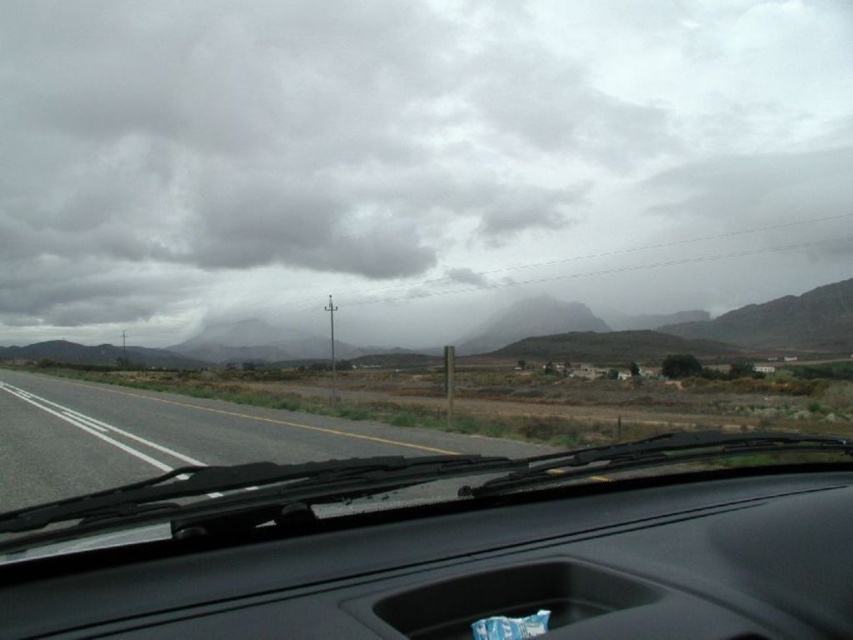
Question: Is gray cloudy sky at upper center positioned at the back of asphalt road at left?

Choices:
 (A) no
 (B) yes

Answer: (B)

Question: Which point is farther to the camera?

Choices:
 (A) (474, 566)
 (B) (132, 452)

Answer: (B)

Question: Is gray cloudy sky at upper center closer to camera compared to black matte dashboard at center?

Choices:
 (A) yes
 (B) no

Answer: (B)

Question: Among these objects, which one is farthest from the camera?

Choices:
 (A) gray cloudy sky at upper center
 (B) asphalt road at left
 (C) black matte dashboard at center

Answer: (A)

Question: Is gray cloudy sky at upper center to the left of black matte dashboard at center from the viewer's perspective?

Choices:
 (A) no
 (B) yes

Answer: (B)

Question: Which object is closer to the camera taking this photo?

Choices:
 (A) black matte dashboard at center
 (B) asphalt road at left
 (C) gray cloudy sky at upper center

Answer: (A)